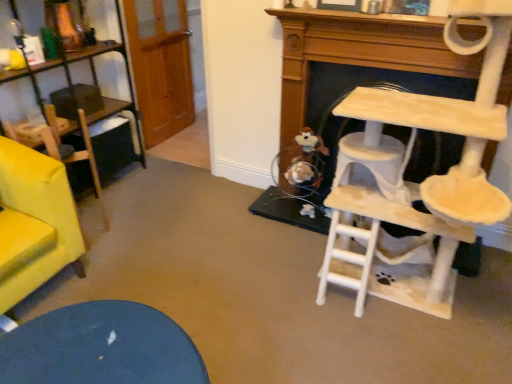
The height and width of the screenshot is (384, 512). I want to click on vacant space that is in between velvet yellow armchair at left and beige wooden cat tree at right, so click(215, 256).